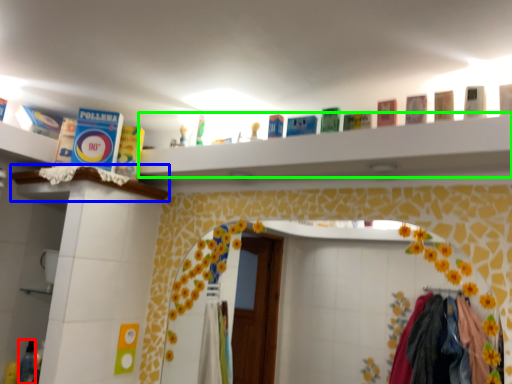
Question: Which is nearer to the toiletry (highlighted by a red box)? ledge (highlighted by a blue box) or ledge (highlighted by a green box).

Choices:
 (A) ledge
 (B) ledge

Answer: (A)